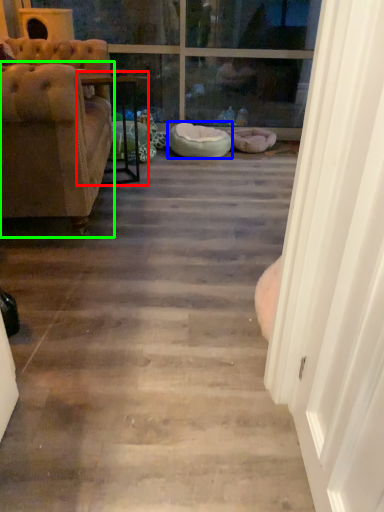
Question: Considering the real-world distances, which object is closest to table (highlighted by a red box)? dog bed (highlighted by a blue box) or chair (highlighted by a green box).

Choices:
 (A) dog bed
 (B) chair

Answer: (A)